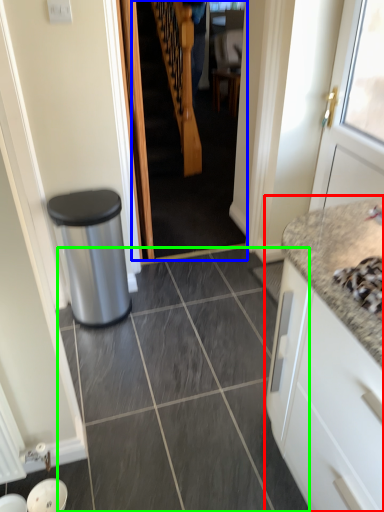
Question: Which object is positioned closest to cabinetry (highlighted by a red box)? Select from stairwell (highlighted by a blue box) and granite (highlighted by a green box).

Choices:
 (A) stairwell
 (B) granite

Answer: (B)